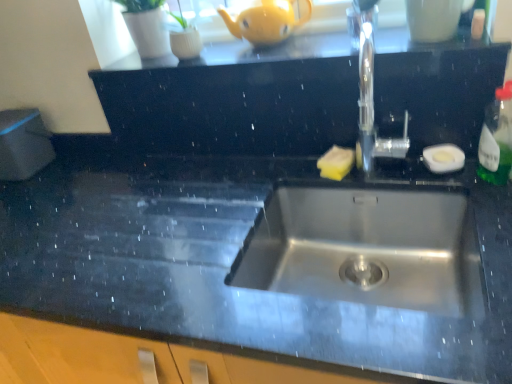
Describe the element at coordinates (497, 138) in the screenshot. I see `green translucent bottle at right` at that location.

I want to click on white glossy mug at upper center, so click(x=434, y=19).

From the picture: Measure the distance between white glossy mug at upper center and camera.

A distance of 35.73 inches exists between white glossy mug at upper center and camera.

Find the location of a particular element. green translucent bottle at right is located at coordinates (497, 138).

Which point is more forward, (502,183) or (421,36)?

The point (502,183) is in front.

From a real-world perspective, relative to white glossy mug at upper center, is green translucent bottle at right vertically above or below?

Clearly, from a real-world perspective, green translucent bottle at right is below white glossy mug at upper center.

Where is `bottle in front of the white glossy mug at upper center`? This screenshot has width=512, height=384. bottle in front of the white glossy mug at upper center is located at coordinates (497, 138).

Does green translucent bottle at right come in front of white glossy mug at upper center?

Yes, green translucent bottle at right is in front of white glossy mug at upper center.

How distant is yellow matte teapot at upper center from polished stainless steel tap at upper center?

yellow matte teapot at upper center is 11.14 inches away from polished stainless steel tap at upper center.

Where is `tap that is in front of the yellow matte teapot at upper center`? The width and height of the screenshot is (512, 384). tap that is in front of the yellow matte teapot at upper center is located at coordinates (370, 91).

From a real-world perspective, is yellow matte teapot at upper center positioned above or below polished stainless steel tap at upper center?

yellow matte teapot at upper center is situated higher than polished stainless steel tap at upper center in the real world.

Does yellow matte teapot at upper center appear on the left side of polished stainless steel tap at upper center?

Yes.

Which object is closer to the camera taking this photo, yellow matte teapot at upper center or black granite dresser at center?

black granite dresser at center is more forward.

From the image's perspective, does yellow matte teapot at upper center appear lower than black granite dresser at center?

No, from the image's perspective, yellow matte teapot at upper center is not below black granite dresser at center.

Based on the photo, which of these two, yellow matte teapot at upper center or black granite dresser at center, stands shorter?

yellow matte teapot at upper center is shorter.

Which of these two, yellow matte teapot at upper center or black granite dresser at center, is thinner?

yellow matte teapot at upper center is thinner.

Is white glossy mug at upper center at the right side of polished stainless steel tap at upper center?

Yes, white glossy mug at upper center is to the right of polished stainless steel tap at upper center.

Is polished stainless steel tap at upper center at the back of white glossy mug at upper center?

No.

From a real-world perspective, which is physically below, white glossy mug at upper center or polished stainless steel tap at upper center?

In real-world perspective, polished stainless steel tap at upper center is lower.

Considering the sizes of objects white glossy mug at upper center and polished stainless steel tap at upper center in the image provided, who is bigger, white glossy mug at upper center or polished stainless steel tap at upper center?

polished stainless steel tap at upper center.

Considering the relative sizes of polished stainless steel tap at upper center and green translucent bottle at right in the image provided, is polished stainless steel tap at upper center wider than green translucent bottle at right?

Indeed, polished stainless steel tap at upper center has a greater width compared to green translucent bottle at right.

Which object is positioned more to the right, polished stainless steel tap at upper center or green translucent bottle at right?

green translucent bottle at right is more to the right.

From a real-world perspective, is polished stainless steel tap at upper center above or below green translucent bottle at right?

polished stainless steel tap at upper center is situated higher than green translucent bottle at right in the real world.

Considering the positions of objects polished stainless steel tap at upper center and green translucent bottle at right in the image provided, who is behind, polished stainless steel tap at upper center or green translucent bottle at right?

green translucent bottle at right is further away from the camera.

Is black granite dresser at center closer to camera compared to polished stainless steel tap at upper center?

No, the depth of black granite dresser at center is greater than that of polished stainless steel tap at upper center.

Can you confirm if black granite dresser at center is taller than polished stainless steel tap at upper center?

In fact, black granite dresser at center may be shorter than polished stainless steel tap at upper center.

This screenshot has height=384, width=512. I want to click on dresser behind the polished stainless steel tap at upper center, so click(237, 99).

Is black granite dresser at center facing away from polished stainless steel tap at upper center?

No, polished stainless steel tap at upper center is not at the back of black granite dresser at center.

From a real-world perspective, between polished stainless steel tap at upper center and black granite dresser at center, who is vertically lower?

black granite dresser at center, from a real-world perspective.

Locate an element on the screen. The height and width of the screenshot is (384, 512). dresser above the polished stainless steel tap at upper center (from the image's perspective) is located at coordinates (237, 99).

Is black granite dresser at center at the back of polished stainless steel tap at upper center?

That's right, polished stainless steel tap at upper center is facing away from black granite dresser at center.

The height and width of the screenshot is (384, 512). What are the coordinates of `bottle below the white glossy mug at upper center (from a real-world perspective)` in the screenshot? It's located at (497, 138).

In order to click on tea pot located behind the polished stainless steel tap at upper center in this screenshot , I will do `click(266, 21)`.

From the image, which object appears to be farther from green translucent bottle at right, polished stainless steel tap at upper center or black granite dresser at center?

black granite dresser at center is positioned further to the anchor green translucent bottle at right.

Estimate the real-world distances between objects in this image. Which object is further from white glossy mug at upper center, polished stainless steel tap at upper center or yellow matte teapot at upper center?

Among the two, yellow matte teapot at upper center is located further to white glossy mug at upper center.

From the image, which object appears to be farther from polished stainless steel tap at upper center, black granite dresser at center or green translucent bottle at right?

green translucent bottle at right.

From the image, which object appears to be nearer to yellow matte teapot at upper center, black granite dresser at center or white glossy mug at upper center?

Based on the image, black granite dresser at center appears to be nearer to yellow matte teapot at upper center.

Estimate the real-world distances between objects in this image. Which object is further from green translucent bottle at right, black granite dresser at center or white glossy mug at upper center?

The object further to green translucent bottle at right is black granite dresser at center.

Considering their positions, is black granite dresser at center positioned closer to yellow matte teapot at upper center than green translucent bottle at right?

Among the two, black granite dresser at center is located nearer to yellow matte teapot at upper center.

When comparing their distances from white glossy mug at upper center, does polished stainless steel tap at upper center or black granite dresser at center seem closer?

polished stainless steel tap at upper center.

From the image, which object appears to be nearer to white glossy mug at upper center, yellow matte teapot at upper center or black granite dresser at center?

The object closer to white glossy mug at upper center is black granite dresser at center.

You are a GUI agent. You are given a task and a screenshot of the screen. Output one action in this format:
    pyautogui.click(x=<x>, y=<y>)
    Task: Click on the appliance between black granite dresser at center and green translucent bottle at right
    This screenshot has height=384, width=512.
    Given the screenshot: What is the action you would take?
    pyautogui.click(x=434, y=19)

This screenshot has height=384, width=512. I want to click on dresser situated between yellow matte teapot at upper center and white glossy mug at upper center from left to right, so click(x=237, y=99).

I want to click on tap between black granite dresser at center and white glossy mug at upper center from left to right, so click(x=370, y=91).

Identify the location of dresser situated between yellow matte teapot at upper center and green translucent bottle at right from left to right. The width and height of the screenshot is (512, 384). (237, 99).